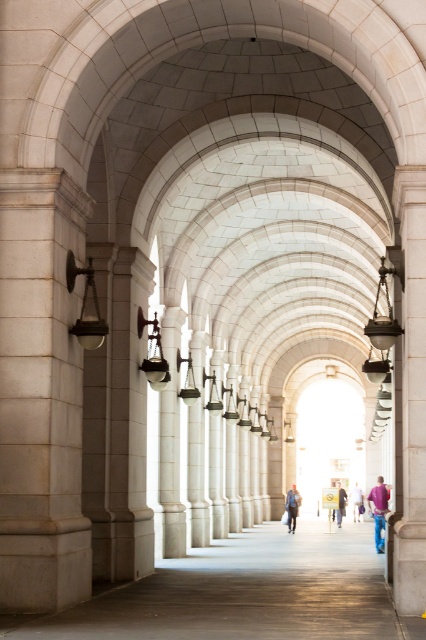
Question: Estimate the real-world distances between objects in this image. Which object is farther from the white marble column at left?

Choices:
 (A) blue jeans at center
 (B) blue denim jacket at center
 (C) dark blue jeans at center
 (D) matte glass lamp at left

Answer: (A)

Question: Which point is closer to the camera?

Choices:
 (A) purple cotton shirt at lower right
 (B) dark blue jeans at center

Answer: (A)

Question: Which of the following is the closest to the observer?

Choices:
 (A) (66, 262)
 (B) (290, 509)

Answer: (A)

Question: Does white marble column at left appear over dark blue jeans at center?

Choices:
 (A) no
 (B) yes

Answer: (B)

Question: Does smooth stone walkway at center appear over purple cotton shirt at lower right?

Choices:
 (A) yes
 (B) no

Answer: (A)

Question: In this image, where is smooth stone walkway at center located relative to purple cotton shirt at lower right?

Choices:
 (A) above
 (B) below

Answer: (A)